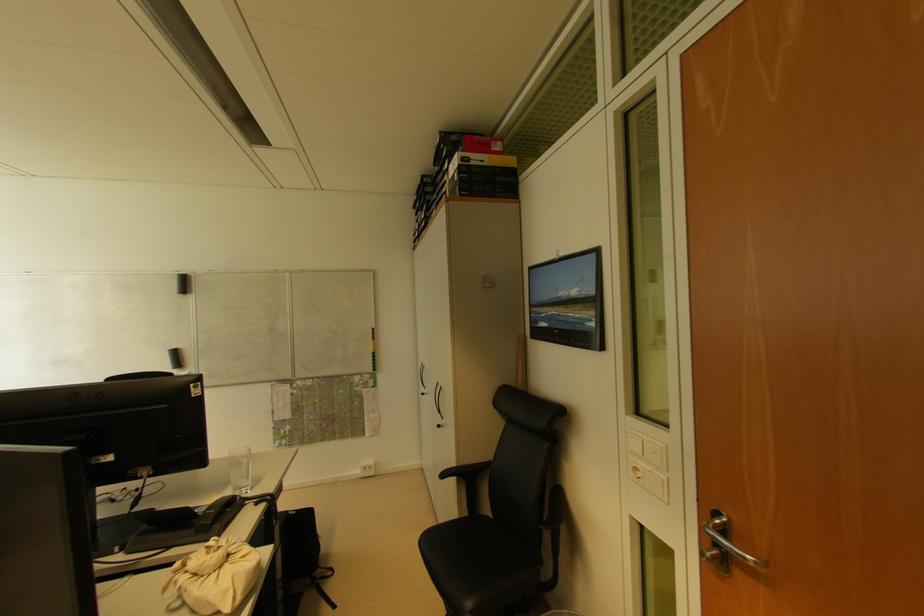
This screenshot has width=924, height=616. I want to click on white cabinet handle, so click(x=723, y=545).